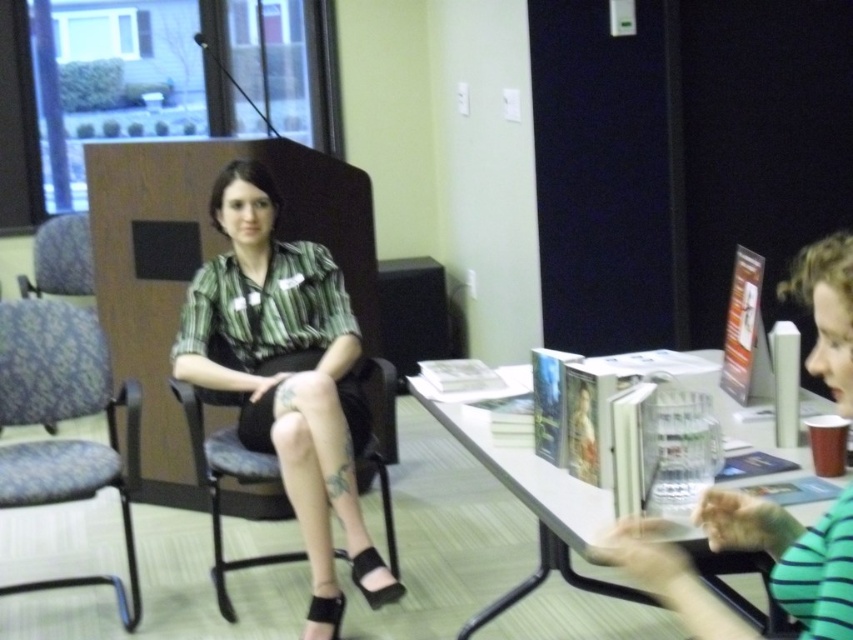
What is located at the coordinates point (x=287, y=378) in the image?

The matte green shirt at center is located at point (x=287, y=378).